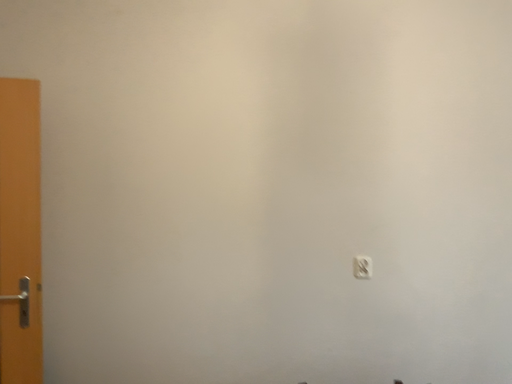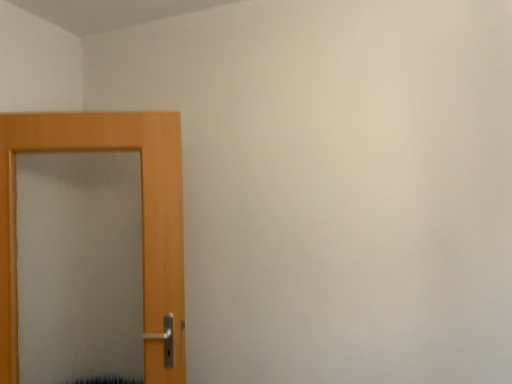
Question: Which way did the camera rotate in the video?

Choices:
 (A) rotated right
 (B) rotated left

Answer: (B)